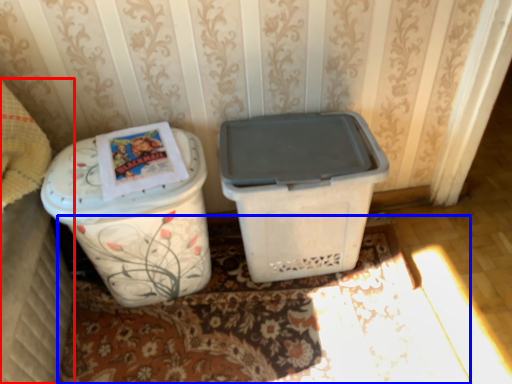
Question: Which point is further to the camera, leftover (highlighted by a red box) or doormat (highlighted by a blue box)?

Choices:
 (A) leftover
 (B) doormat

Answer: (B)